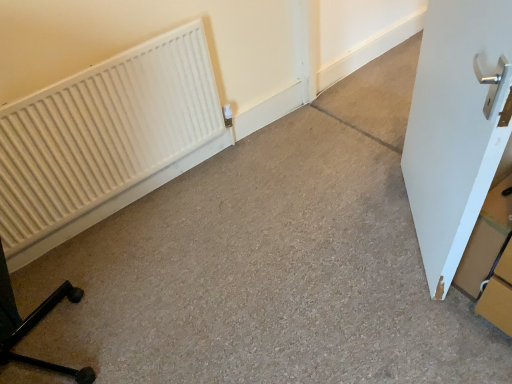
Question: Is white matte door at right facing towards white matte radiator at left?

Choices:
 (A) no
 (B) yes

Answer: (B)

Question: Is white matte door at right bigger than white matte radiator at left?

Choices:
 (A) no
 (B) yes

Answer: (B)

Question: Considering the relative positions of white matte door at right and white matte radiator at left in the image provided, is white matte door at right to the right of white matte radiator at left from the viewer's perspective?

Choices:
 (A) no
 (B) yes

Answer: (B)

Question: Is white matte door at right wider than white matte radiator at left?

Choices:
 (A) no
 (B) yes

Answer: (B)

Question: Is white matte door at right taller than white matte radiator at left?

Choices:
 (A) no
 (B) yes

Answer: (B)

Question: Is white matte radiator at left located within white matte door at right?

Choices:
 (A) yes
 (B) no

Answer: (B)

Question: Is cardboard box at right aimed at white matte door at right?

Choices:
 (A) yes
 (B) no

Answer: (A)

Question: Would you say cardboard box at right is outside white matte door at right?

Choices:
 (A) no
 (B) yes

Answer: (B)

Question: From a real-world perspective, does cardboard box at right stand above white matte door at right?

Choices:
 (A) no
 (B) yes

Answer: (A)

Question: Is cardboard box at right thinner than white matte door at right?

Choices:
 (A) yes
 (B) no

Answer: (B)

Question: Does cardboard box at right lie in front of white matte door at right?

Choices:
 (A) no
 (B) yes

Answer: (A)

Question: Is cardboard box at right further to the viewer compared to white matte door at right?

Choices:
 (A) no
 (B) yes

Answer: (B)

Question: Is white matte door at right located within white matte radiator at left?

Choices:
 (A) no
 (B) yes

Answer: (A)